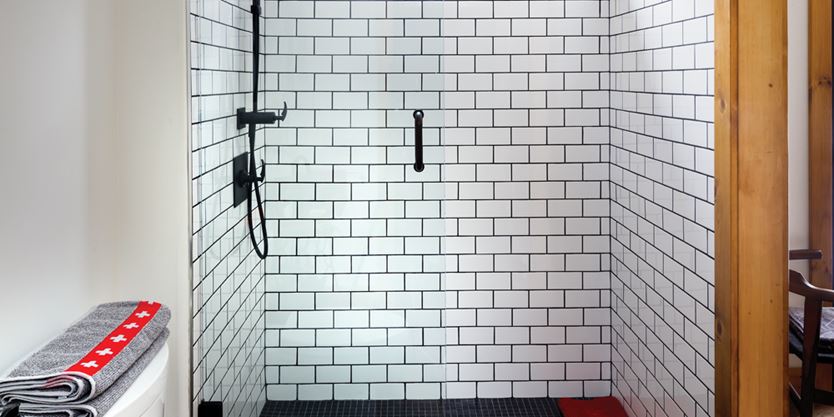
You are a GUI agent. You are given a task and a screenshot of the screen. Output one action in this format:
    pyautogui.click(x=<x>, y=<y>)
    Task: Click on the left wall of shower
    This screenshot has width=834, height=417.
    Given the screenshot: What is the action you would take?
    pyautogui.click(x=227, y=291)